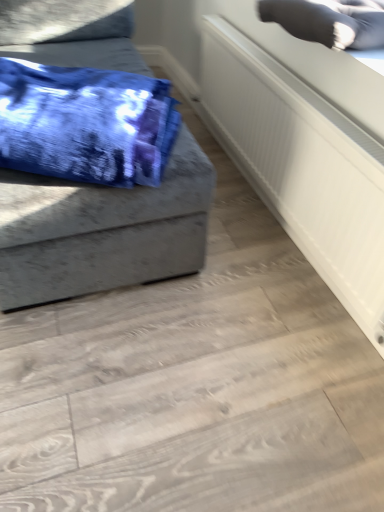
Question: In the image, is blue tie-dye fabric at left positioned in front of or behind gray fabric pillow at upper right?

Choices:
 (A) behind
 (B) front

Answer: (B)

Question: Is blue tie-dye fabric at left bigger or smaller than gray fabric pillow at upper right?

Choices:
 (A) big
 (B) small

Answer: (A)

Question: Which of these objects is positioned closest to the blue tie-dye fabric at left?

Choices:
 (A) gray fabric pillow at upper right
 (B) white textured radiator at upper right

Answer: (B)

Question: Which object is positioned farthest from the white textured radiator at upper right?

Choices:
 (A) gray fabric pillow at upper right
 (B) blue tie-dye fabric at left

Answer: (B)